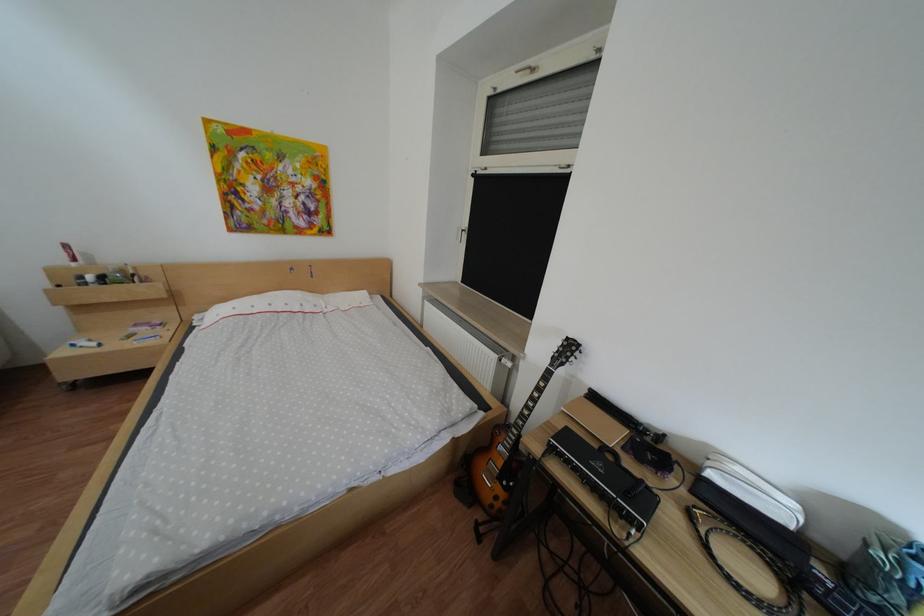
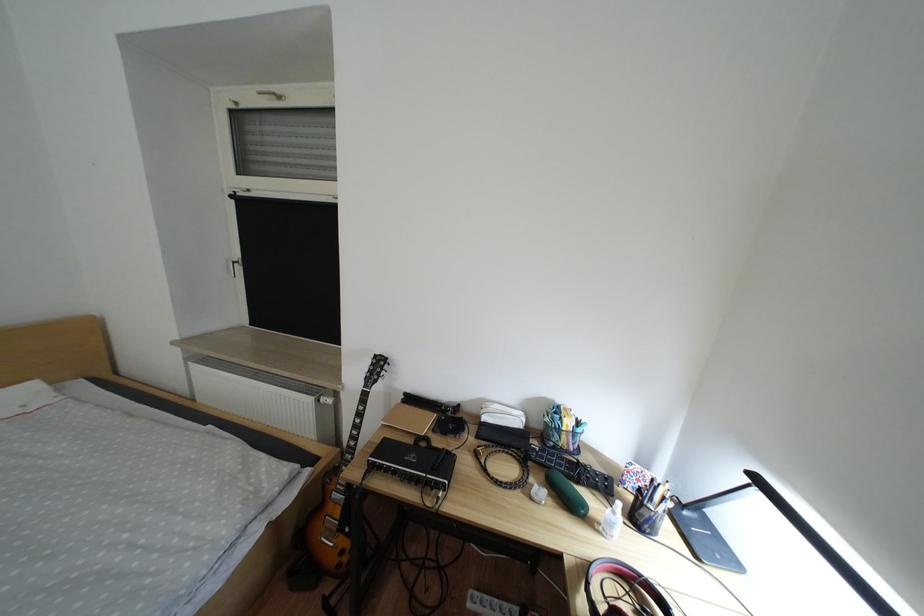
In the second image, find the point that corresponds to (727,476) in the first image.

(501, 419)